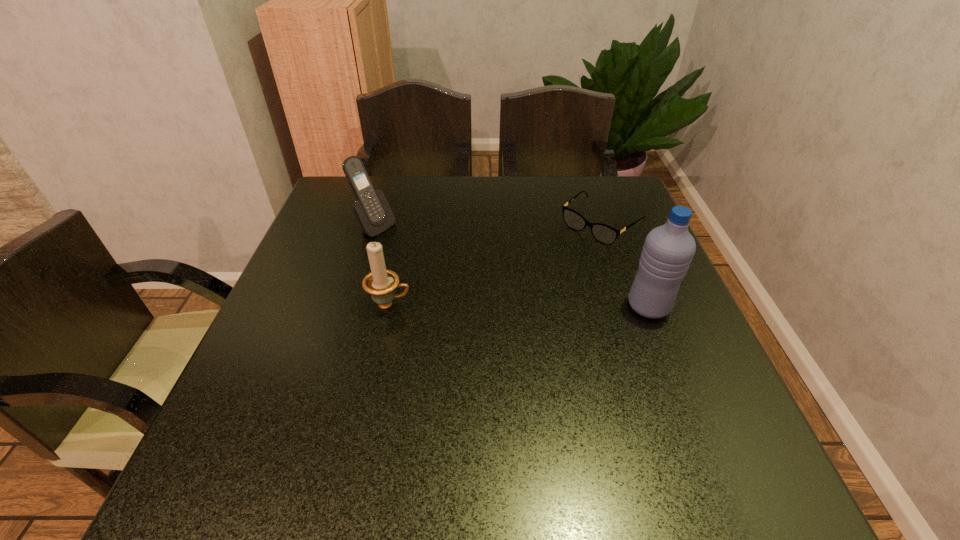
Locate an element on the screen. vacant space on the desktop that is between the candle_holder and the water bottle and is positioned on the front-facing side of the cellular telephone is located at coordinates (516, 306).

Where is `free space on the desktop that is between the candle_holder and the water bottle and is positioned on the front-facing side of the shortest object`? This screenshot has height=540, width=960. free space on the desktop that is between the candle_holder and the water bottle and is positioned on the front-facing side of the shortest object is located at coordinates (501, 305).